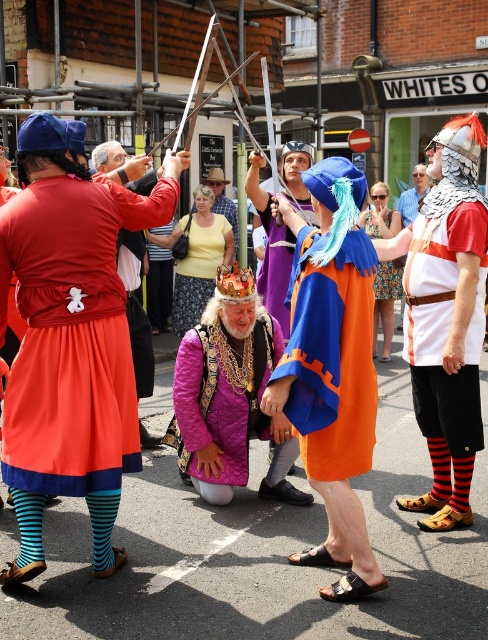
Question: Can you confirm if matte red cape at left is positioned above purple velvet crown at center?

Choices:
 (A) yes
 (B) no

Answer: (B)

Question: Which point is closer to the camera?

Choices:
 (A) (351, 330)
 (B) (89, 285)

Answer: (A)

Question: Can you confirm if purple velvet crown at center is positioned to the right of printed fabric dress at center?

Choices:
 (A) no
 (B) yes

Answer: (A)

Question: Is matte red skirt at left positioned behind orange fabric cape at center?

Choices:
 (A) no
 (B) yes

Answer: (B)

Question: Which of the following is the closest to the observer?

Choices:
 (A) (133, 241)
 (B) (202, 253)
 (C) (224, 202)
 (D) (324, 384)

Answer: (D)

Question: Among these points, which one is farthest from the camera?

Choices:
 (A) (88, 436)
 (B) (375, 230)

Answer: (B)